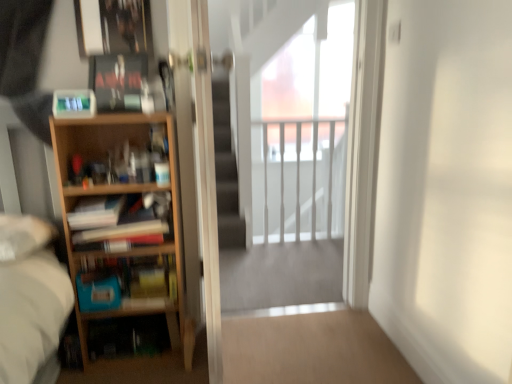
Find the location of a particular element. vacant space situated above matte black book at upper left, the third book in the bottom-to-top sequence (from a real-world perspective) is located at coordinates (120, 50).